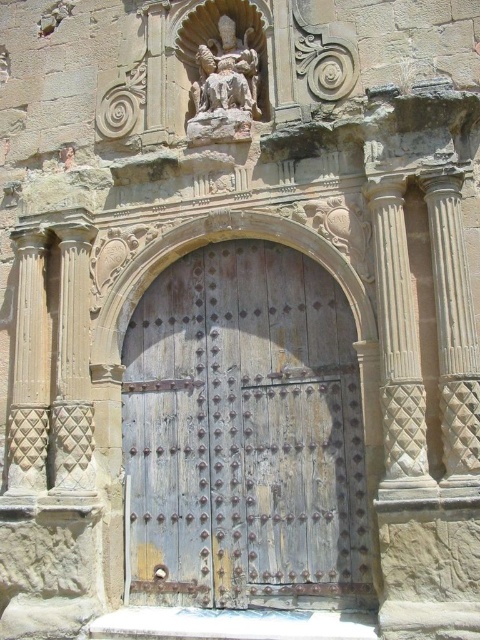
You are an architect assessing the structural integrity of the entrance. Given that the weathered wood door at center and the polished stone column at left are both critical components, which one would require a stronger support system due to its size?

The weathered wood door at center requires a stronger support system because it is larger in size than the polished stone column at left, necessitating more robust structural reinforcement to bear its weight and maintain stability.

You are an architect examining the entrance of a historic building. You notice two columns supporting the arch above the door. Which column, the smooth stone column at right or the polished stone column at left, is located higher up relative to the other?

The smooth stone column at right is positioned over the polished stone column at left, meaning it is higher up.

You are a painter who needs to set up an easel 6 meters away from the polished stone column at left to capture the weathered wood door at center in your painting. Based on the scene description, will your easel placement be too far or too close to the door?

The weathered wood door at center is 5.71 meters from the polished stone column at left. Setting up the easel 6 meters away from the polished stone column at left would place it slightly farther than the door, making it too far to capture the weathered wood door at center effectively.